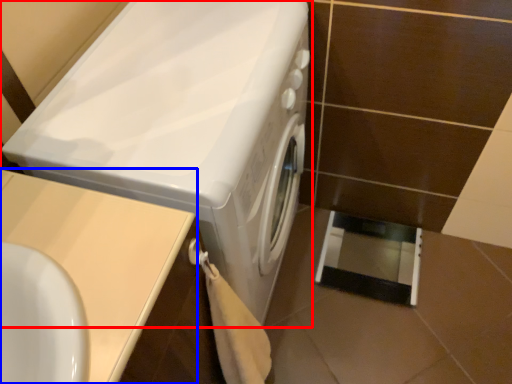
Question: Which object is further to the camera taking this photo, washing machine (highlighted by a red box) or counter top (highlighted by a blue box)?

Choices:
 (A) washing machine
 (B) counter top

Answer: (A)